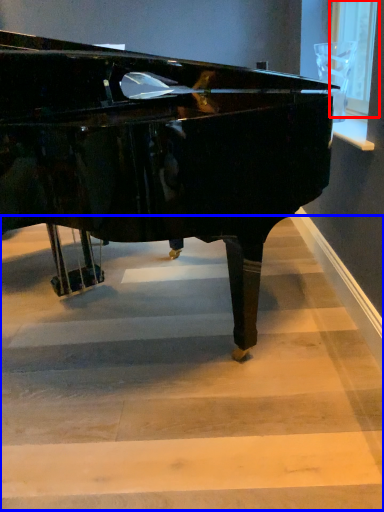
Question: Which point is further to the camera, window screen (highlighted by a red box) or stairwell (highlighted by a blue box)?

Choices:
 (A) window screen
 (B) stairwell

Answer: (A)